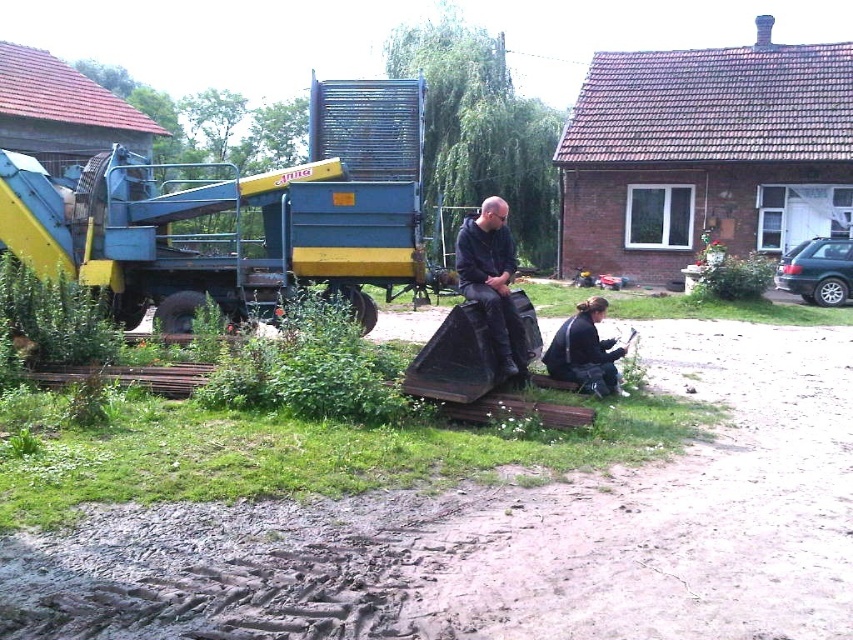
You are a photographer trying to capture both the dark blue leather jacket at center and the black fabric jacket at lower center in a single frame. Based on their sizes, which jacket would appear smaller in the photo?

The dark blue leather jacket at center has a lesser width compared to the black fabric jacket at lower center, so it would appear smaller in the photo.

You are standing at the origin point of the coordinate system in the image. The dark blue leather jacket at center is located at point 0.438, 0.578. If you want to walk directly to the jacket, in which direction should you move?

To reach the dark blue leather jacket at center located at coordinates (x=492, y=280) from the origin, you would need to move northeast since both the x and y coordinates are positive and greater than zero.

You are standing at the point marked by the coordinates point (492, 280). Looking around, you see the dark blue leather jacket at center. What is the nearest object to you?

The nearest object to you is the dark blue leather jacket at center, as you are standing exactly at the point marking its location.